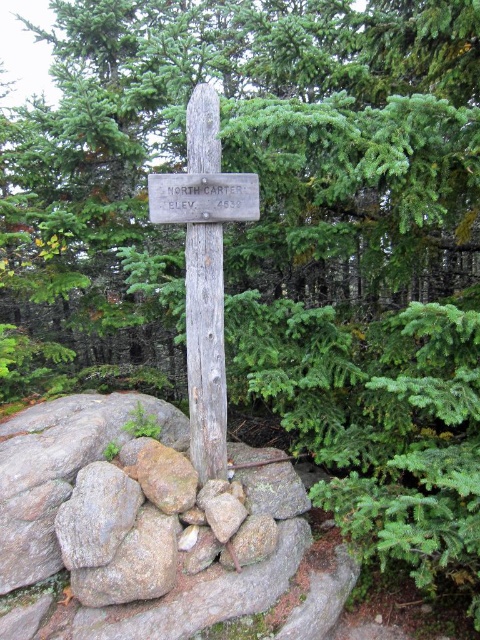
Can you confirm if green rough wood sign at center is bigger than weathered wood pole at center?

Yes, green rough wood sign at center is bigger than weathered wood pole at center.

Does point (279, 76) come in front of point (208, 364)?

No.

This screenshot has height=640, width=480. Identify the location of green rough wood sign at center. (259, 138).

Who is more forward, (x=217, y=353) or (x=240, y=177)?

Point (x=240, y=177) is more forward.

Is point (207, 268) positioned before point (189, 200)?

No, (207, 268) is behind (189, 200).

The width and height of the screenshot is (480, 640). I want to click on weathered wood cross at center, so click(204, 268).

Describe the element at coordinates (259, 138) in the screenshot. This screenshot has width=480, height=640. I see `green rough wood sign at center` at that location.

Based on the photo, can you confirm if green rough wood sign at center is shorter than weathered wood cross at center?

No, green rough wood sign at center is not shorter than weathered wood cross at center.

The width and height of the screenshot is (480, 640). Identify the location of green rough wood sign at center. (259, 138).